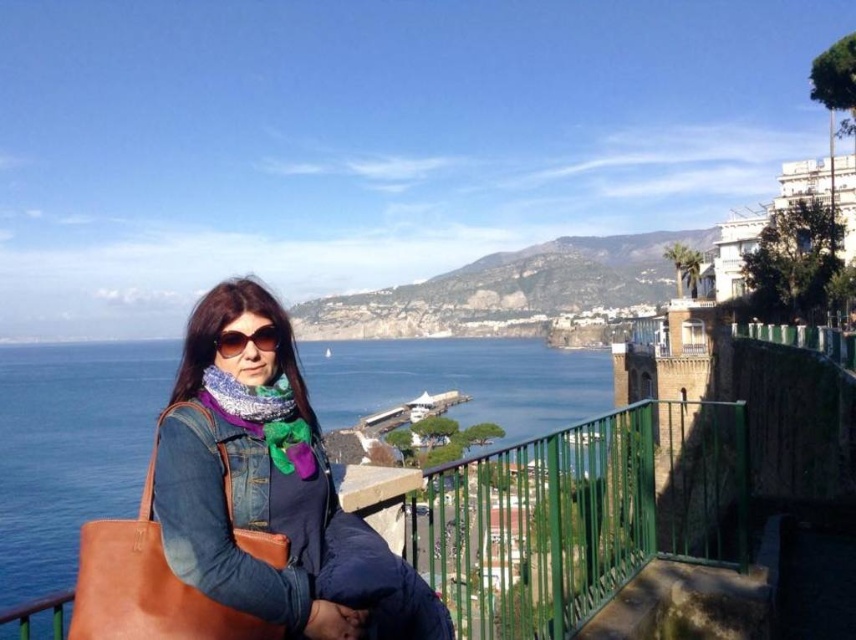
Between denim jacket at center and knitted multicolor scarf at center, which one has less height?

With less height is knitted multicolor scarf at center.

Between denim jacket at center and knitted multicolor scarf at center, which one appears on the right side from the viewer's perspective?

Positioned to the right is knitted multicolor scarf at center.

Is point (171, 490) closer to viewer compared to point (299, 449)?

Yes, point (171, 490) is in front of point (299, 449).

Identify the location of denim jacket at center. (227, 548).

Does leather bag at left have a larger size compared to knitted multicolor scarf at center?

Indeed, leather bag at left has a larger size compared to knitted multicolor scarf at center.

Image resolution: width=856 pixels, height=640 pixels. Identify the location of leather bag at left. (147, 580).

Find the location of a particular element. The width and height of the screenshot is (856, 640). leather bag at left is located at coordinates (147, 580).

Where is `denim jacket at center`? denim jacket at center is located at coordinates (227, 548).

Between point (201, 477) and point (129, 596), which one is positioned in front?

Point (129, 596) is more forward.

Where is `denim jacket at center`? This screenshot has width=856, height=640. denim jacket at center is located at coordinates (227, 548).